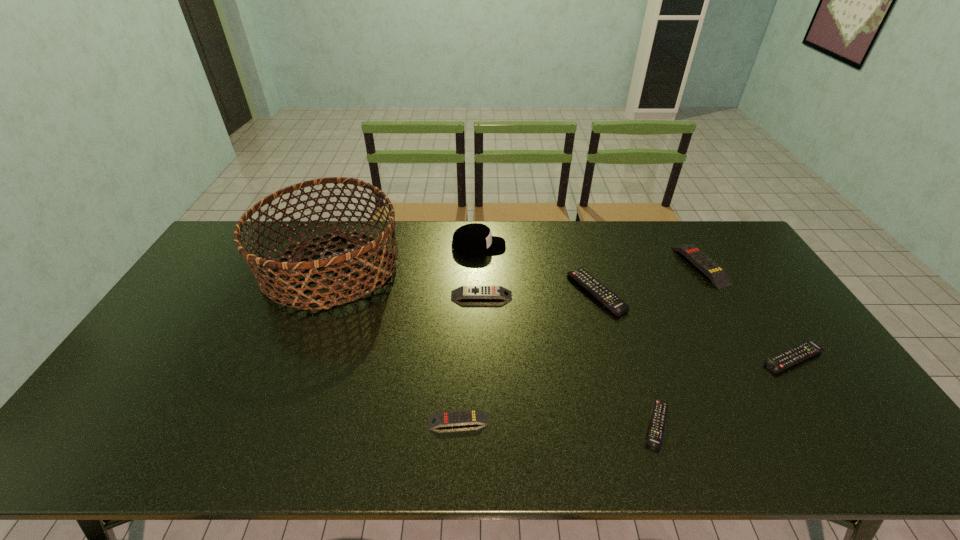
You are a GUI agent. You are given a task and a screenshot of the screen. Output one action in this format:
    pyautogui.click(x=<x>, y=<y>)
    Task: Click on the free space located on the back of the smallest black remote control
    
    Given the screenshot: What is the action you would take?
    pyautogui.click(x=624, y=326)

Identify the location of basket that is at the far edge. (278, 287).

The image size is (960, 540). Identify the location of cap that is at the far edge. (475, 238).

Locate an element on the screen. The image size is (960, 540). remote control at the far edge is located at coordinates (717, 275).

Where is `object present at the far right corner`? Image resolution: width=960 pixels, height=540 pixels. object present at the far right corner is located at coordinates (717, 275).

The image size is (960, 540). I want to click on vacant space at the far edge, so click(x=541, y=249).

Where is `free space at the near edge of the desktop`? This screenshot has height=540, width=960. free space at the near edge of the desktop is located at coordinates tap(722, 437).

Image resolution: width=960 pixels, height=540 pixels. What are the coordinates of `free space at the left edge of the desktop` in the screenshot? It's located at (202, 295).

You are a GUI agent. You are given a task and a screenshot of the screen. Output one action in this format:
    pyautogui.click(x=<x>, y=<y>)
    Task: Click on the free location at the right edge
    This screenshot has height=540, width=960.
    Given the screenshot: What is the action you would take?
    pyautogui.click(x=733, y=280)

The height and width of the screenshot is (540, 960). I want to click on free point at the far left corner, so click(x=222, y=260).